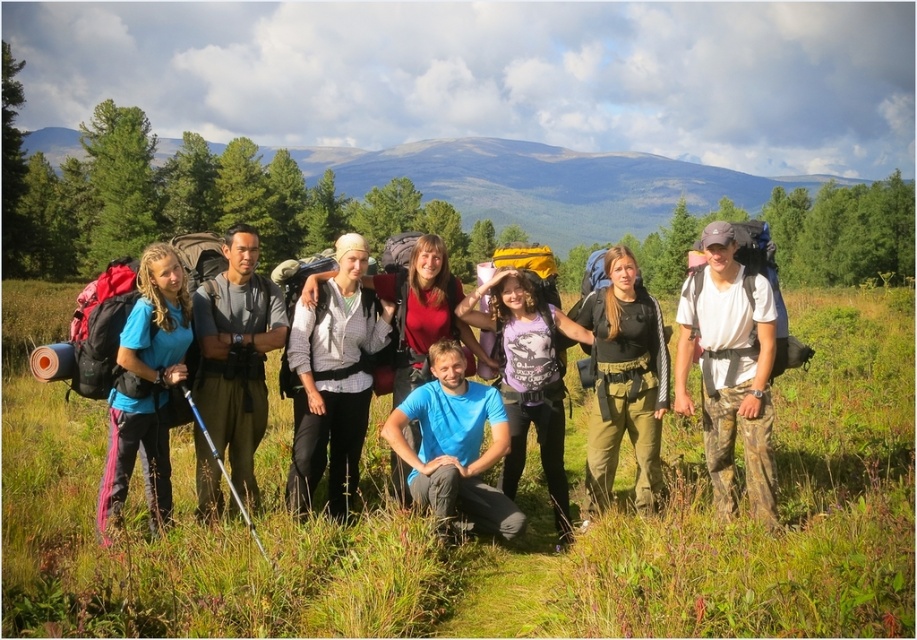
Question: Which point is closer to the camera?

Choices:
 (A) (163, 310)
 (B) (653, 417)

Answer: (A)

Question: Does black matte shirt at center appear under teal matte shirt at left?

Choices:
 (A) yes
 (B) no

Answer: (B)

Question: Can you confirm if black matte shirt at center is wider than blue matte shirt at center?

Choices:
 (A) no
 (B) yes

Answer: (A)

Question: Can you confirm if black matte shirt at center is positioned to the left of teal matte shirt at left?

Choices:
 (A) yes
 (B) no

Answer: (B)

Question: Which of the following is the farthest from the observer?

Choices:
 (A) matte black backpacks at center
 (B) teal matte shirt at left
 (C) black matte shirt at center
 (D) blue matte shirt at center

Answer: (A)

Question: Which object is closer to the camera taking this photo?

Choices:
 (A) teal matte shirt at left
 (B) blue matte shirt at center

Answer: (A)